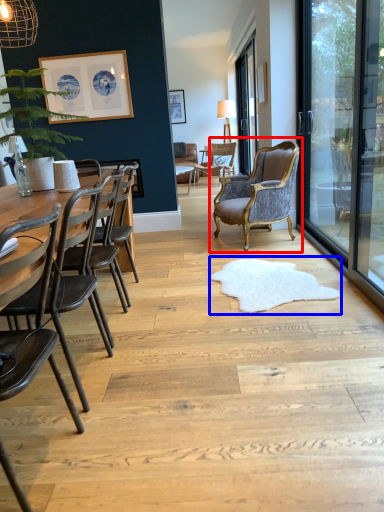
Question: Which object is closer to the camera taking this photo, chair (highlighted by a red box) or mat (highlighted by a blue box)?

Choices:
 (A) chair
 (B) mat

Answer: (B)